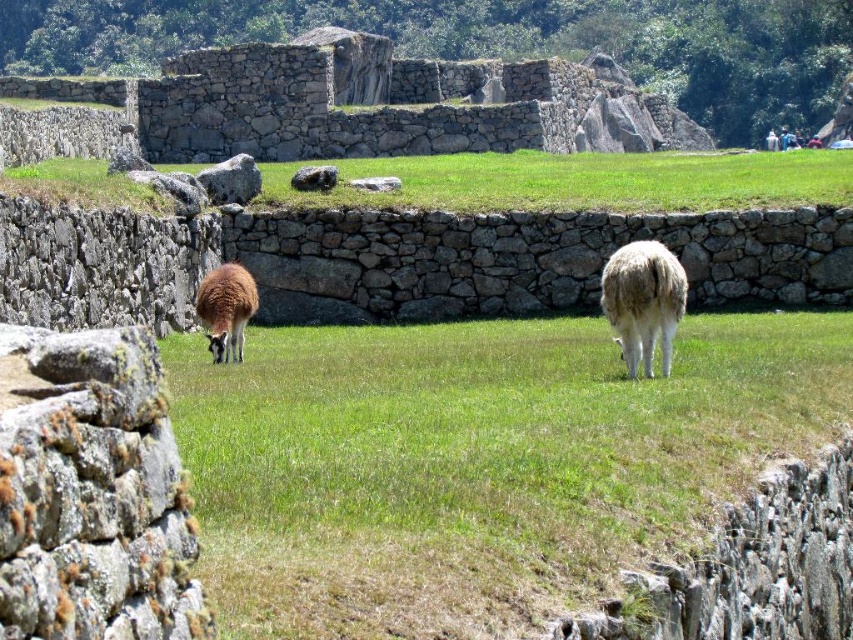
You are standing at the archaeological site and want to take a photo of the light blue fabric at upper right without the brown woolly alpaca at left blocking it. How should you adjust your position?

Move to the right side so that the brown woolly alpaca at left is no longer between you and the light blue fabric at upper right.